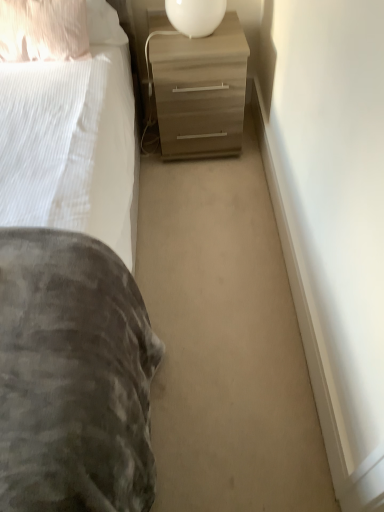
I want to click on free space in front of matte wood chest of drawers at center, so tap(201, 190).